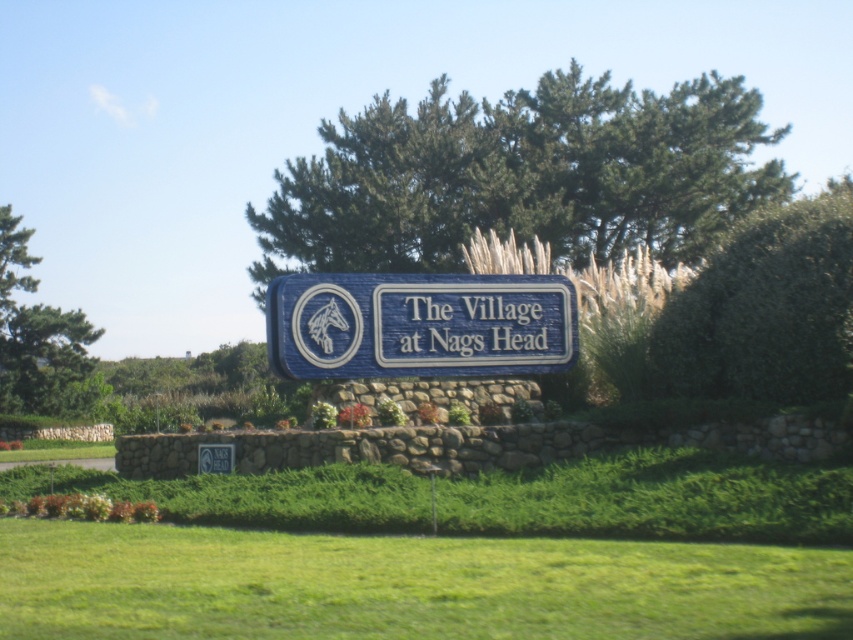
Which of these two, green leafy tree at center or green leafy bush at center right, stands shorter?

Standing shorter between the two is green leafy bush at center right.

Find the location of a particular element. green leafy tree at center is located at coordinates (521, 176).

Which is behind, point (718, 176) or point (778, 276)?

The point (718, 176) is more distant.

Find the location of a particular element. The image size is (853, 640). green leafy tree at center is located at coordinates (521, 176).

Is green leafy tree at center thinner than blue wooden sign at center?

In fact, green leafy tree at center might be wider than blue wooden sign at center.

Does green leafy tree at center appear on the right side of blue wooden sign at center?

Correct, you'll find green leafy tree at center to the right of blue wooden sign at center.

Is point (675, 88) in front of point (494, 292)?

No, it is not.

Image resolution: width=853 pixels, height=640 pixels. I want to click on green leafy tree at center, so click(521, 176).

Who is lower down, blue wooden sign at center or green leafy tree at left?

blue wooden sign at center

Is blue wooden sign at center taller than green leafy tree at left?

Incorrect, blue wooden sign at center's height is not larger of green leafy tree at left's.

Locate an element on the screen. blue wooden sign at center is located at coordinates (418, 324).

The image size is (853, 640). In order to click on blue wooden sign at center in this screenshot , I will do `click(418, 324)`.